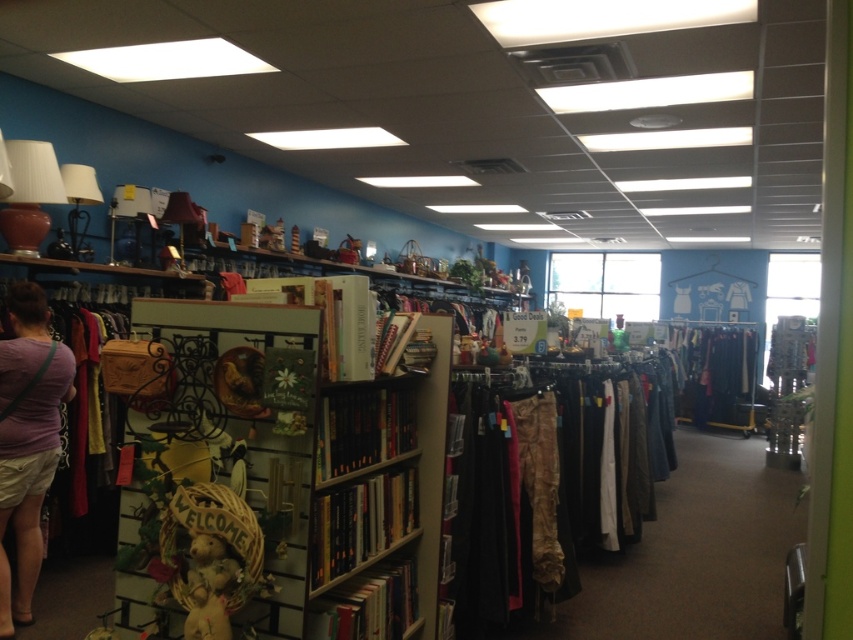
You are a customer in the thrift store and want to know which clothing item is wider between the camouflage pants at center and the purple cotton shirt at left. Can you tell me which one is wider?

The camouflage pants at center is wider than the purple cotton shirt at left according to the description provided.

You are a customer in the thrift store and want to locate the camouflage pants at center. According to the store layout, where should you look?

The camouflage pants at center are located at point (549, 481).